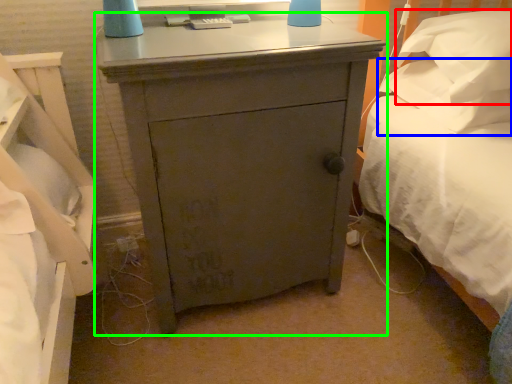
Question: Based on their relative distances, which object is farther from pillow (highlighted by a red box)? Choose from pillow (highlighted by a blue box) and nightstand (highlighted by a green box).

Choices:
 (A) pillow
 (B) nightstand

Answer: (B)